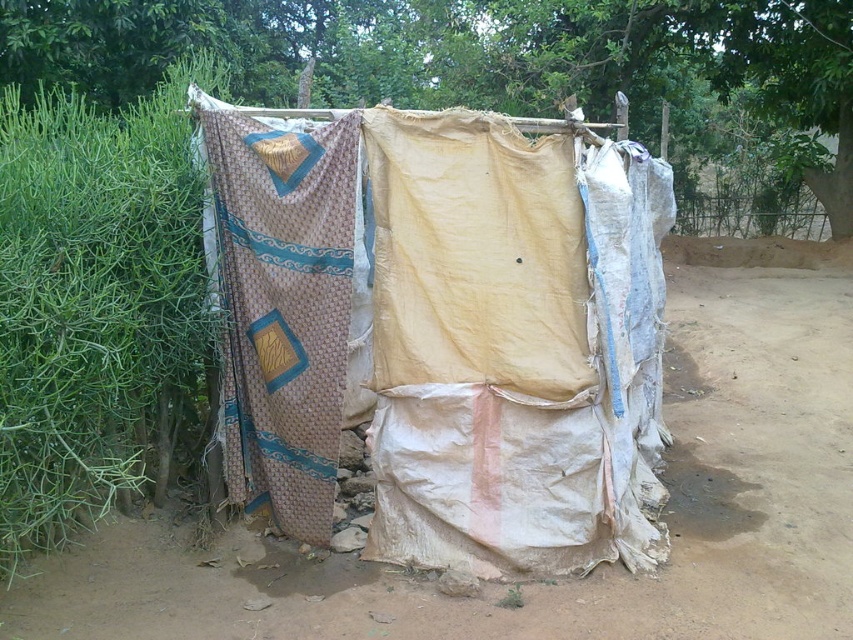
You are setting up a temporary shelter and need to know the arrangement of the cloths. Which cloth is positioned higher in the structure, the printed fabric cloth at center or the beige woven cloth at left?

The printed fabric cloth at center is located above the beige woven cloth at left, so it is positioned higher in the structure.

You are standing at the entrance of the makeshift structure and want to move towards the point labeled as point (468,628). However, there is an obstacle at point (251,353). Can you safely navigate around the obstacle to reach your destination?

Point (468,628) is in front of point (251,353), so you can safely navigate around the obstacle at point (251,353) to reach the destination at point (468,628) since it is closer to you.

You are setting up a tent and have two materials available, the printed fabric cloth at center and the brown dirt field at center. Which material is more suitable for creating a lightweight shelter framework?

The printed fabric cloth at center is thinner than the brown dirt field at center, so it would be more suitable for creating a lightweight shelter framework since it is lighter and easier to handle.